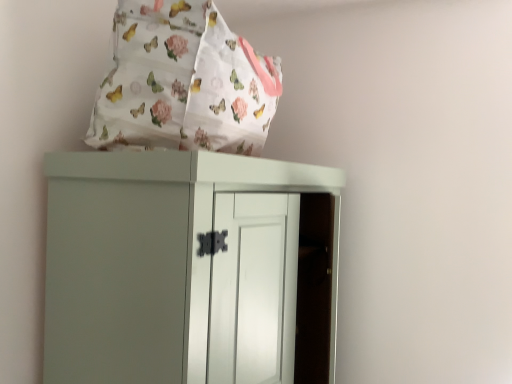
Identify the location of matte white cupboard at center. This screenshot has height=384, width=512. (188, 269).

This screenshot has height=384, width=512. Describe the element at coordinates (188, 269) in the screenshot. I see `matte white cupboard at center` at that location.

Where is `matte white cupboard at center`? This screenshot has width=512, height=384. matte white cupboard at center is located at coordinates [x=188, y=269].